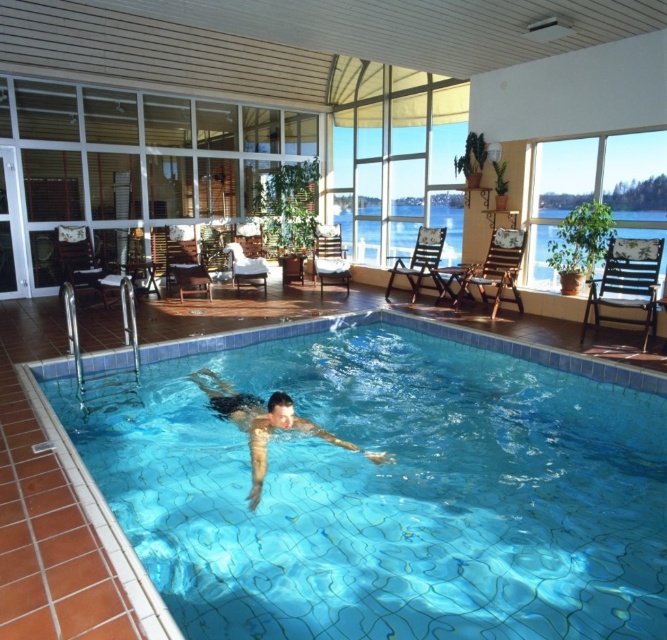
Who is positioned more to the right, blue tile swimming pool at center or skinny man at center?

blue tile swimming pool at center is more to the right.

Who is shorter, blue tile swimming pool at center or skinny man at center?

Standing shorter between the two is skinny man at center.

Which is behind, point (109, 364) or point (267, 426)?

The point (109, 364) is more distant.

Locate an element on the screen. This screenshot has width=667, height=640. blue tile swimming pool at center is located at coordinates (424, 332).